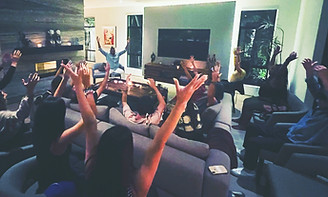
This screenshot has height=197, width=328. In order to click on painting in this screenshot , I will do `click(107, 46)`.